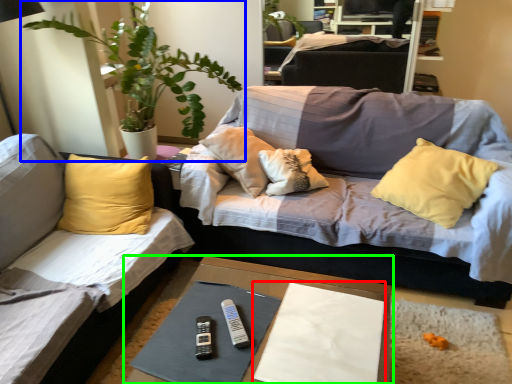
Question: Based on their relative distances, which object is nearer to sheet (highlighted by a red box)? Choose from houseplant (highlighted by a blue box) and table (highlighted by a green box).

Choices:
 (A) houseplant
 (B) table

Answer: (B)